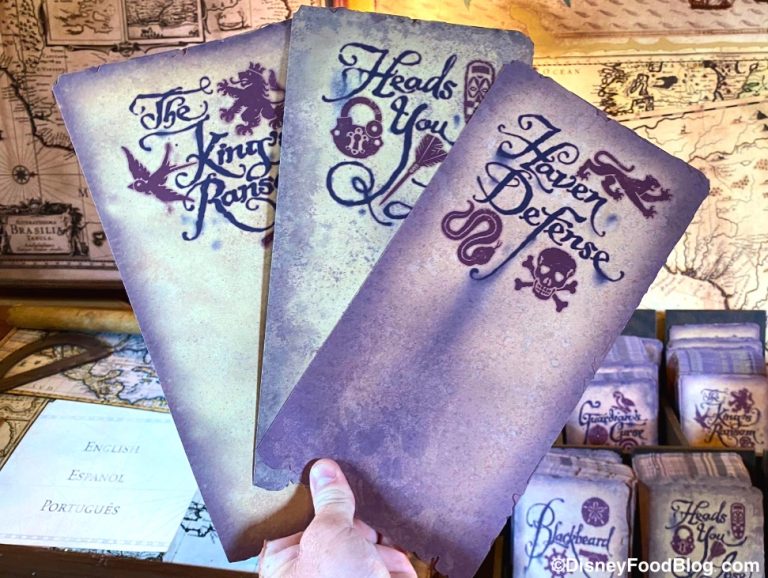
Locate an element on the screen. The height and width of the screenshot is (578, 768). book is located at coordinates (167, 521).